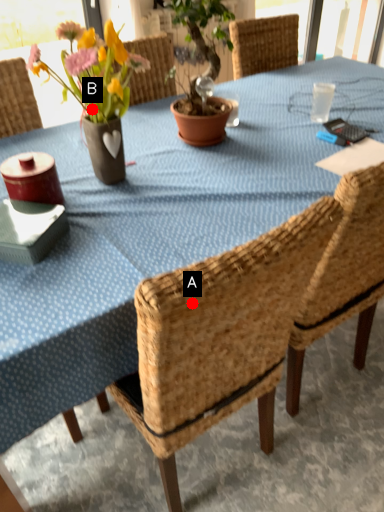
Question: Two points are circled on the image, labeled by A and B beside each circle. Which point is closer to the camera?

Choices:
 (A) A is closer
 (B) B is closer

Answer: (A)